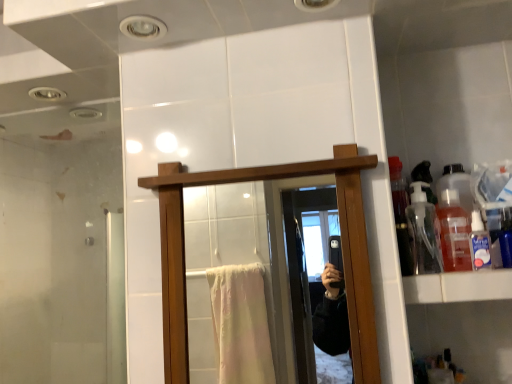
Question: Considering their positions, is clear plastic bottle at upper right located in front of or behind white glossy cabinet at right?

Choices:
 (A) behind
 (B) front

Answer: (A)

Question: Considering the relative positions of clear plastic bottle at upper right and white glossy cabinet at right in the image provided, is clear plastic bottle at upper right to the left or to the right of white glossy cabinet at right?

Choices:
 (A) left
 (B) right

Answer: (B)

Question: Based on their relative distances, which object is farther from the translucent plastic bottle at upper right, the first bottle in the right-to-left sequence?

Choices:
 (A) white glossy cabinet at right
 (B) clear plastic bottle at upper right
 (C) wooden mirror at center
 (D) transparent plastic bottle at upper right, the 1th bottle viewed from the left

Answer: (C)

Question: Which object is positioned closest to the wooden mirror at center?

Choices:
 (A) clear plastic bottle at upper right
 (B) translucent plastic bottle at upper right, arranged as the 2th bottle when viewed from the left
 (C) white glossy cabinet at right
 (D) transparent plastic bottle at upper right, the 2th bottle viewed from the right

Answer: (D)